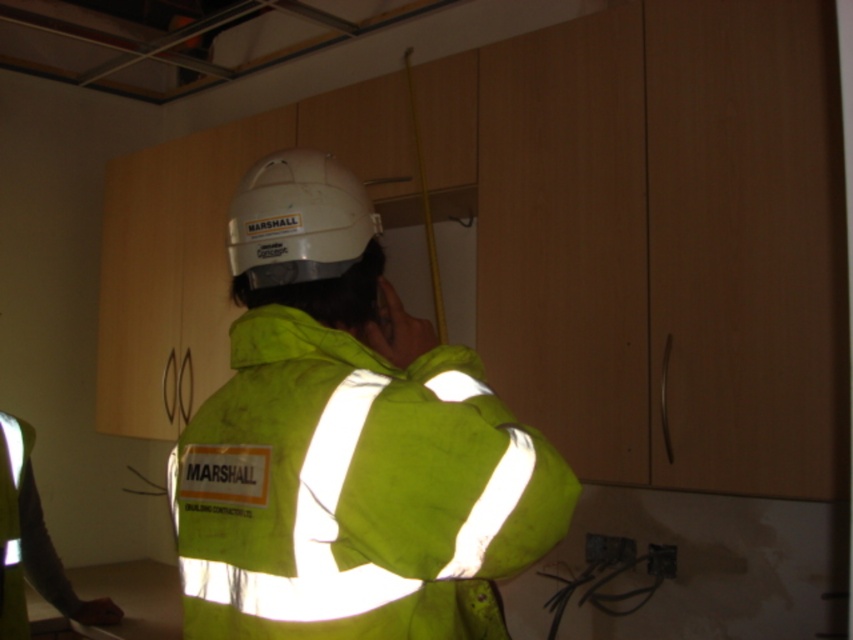
Question: Which of the following is the closest to the observer?

Choices:
 (A) white matte helmet at center
 (B) reflective yellow jacket at center

Answer: (B)

Question: Does reflective yellow jacket at center appear on the right side of white matte helmet at center?

Choices:
 (A) yes
 (B) no

Answer: (A)

Question: Which point appears farthest from the camera in this image?

Choices:
 (A) (508, 548)
 (B) (258, 211)

Answer: (B)

Question: Does reflective yellow jacket at center have a lesser width compared to white matte helmet at center?

Choices:
 (A) no
 (B) yes

Answer: (A)

Question: Is reflective yellow jacket at center positioned at the back of white matte helmet at center?

Choices:
 (A) no
 (B) yes

Answer: (A)

Question: Which point is farther from the camera taking this photo?

Choices:
 (A) (305, 202)
 (B) (265, 177)

Answer: (B)